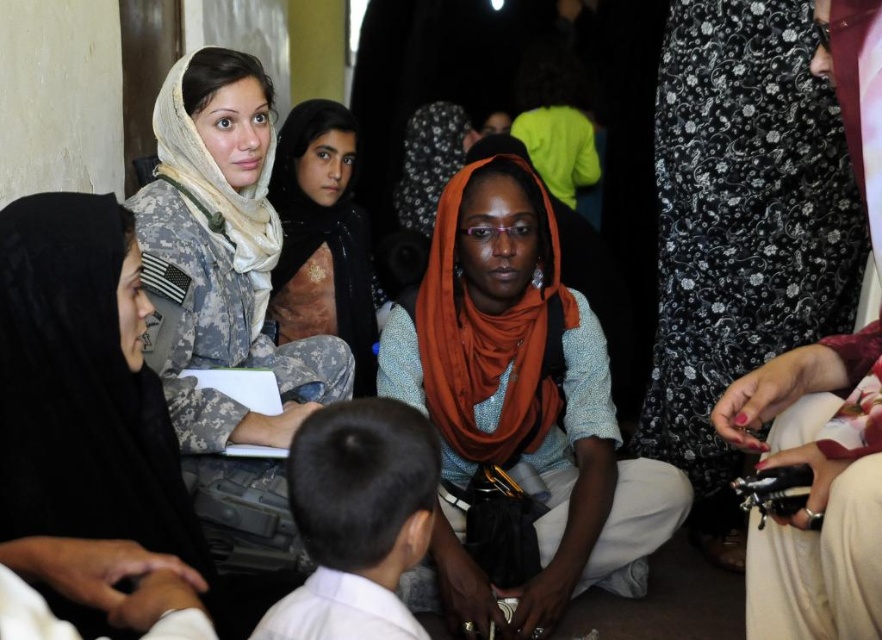
Question: Is orange fabric scarf at center to the left of black matte uniform at left from the viewer's perspective?

Choices:
 (A) yes
 (B) no

Answer: (B)

Question: Can you confirm if black matte uniform at left is wider than black hair at center?

Choices:
 (A) no
 (B) yes

Answer: (A)

Question: Which point is farther from the camera taking this photo?

Choices:
 (A) (312, 422)
 (B) (111, 424)

Answer: (B)

Question: Which point is farther from the camera taking this photo?

Choices:
 (A) (116, 211)
 (B) (235, 253)
 (C) (315, 253)

Answer: (C)

Question: Considering the real-world distances, which object is farthest from the orange fabric scarf at center?

Choices:
 (A) matte khaki uniform at center
 (B) camouflage fabric uniform at upper left
 (C) black matte uniform at left

Answer: (C)

Question: Does camouflage fabric uniform at upper left have a smaller size compared to matte khaki uniform at center?

Choices:
 (A) no
 (B) yes

Answer: (B)